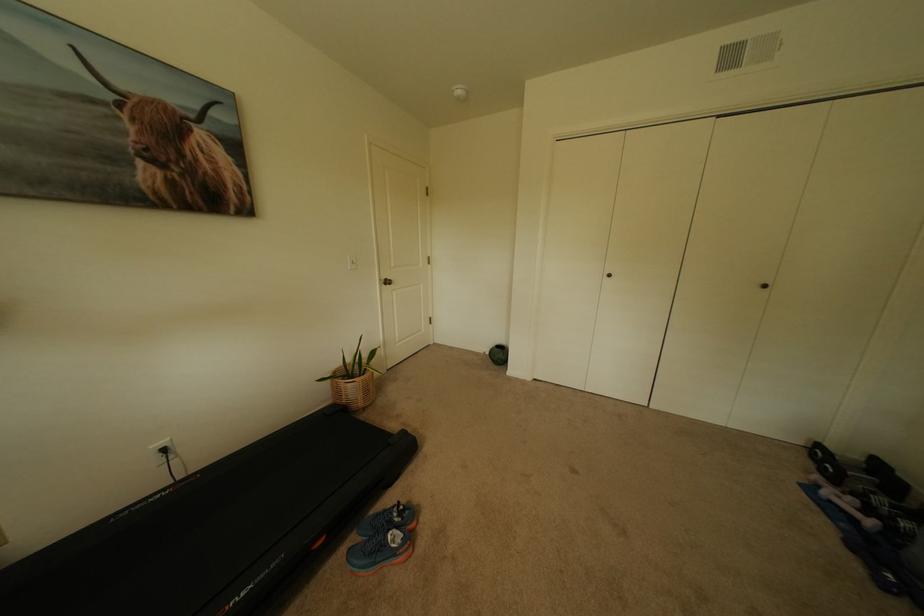
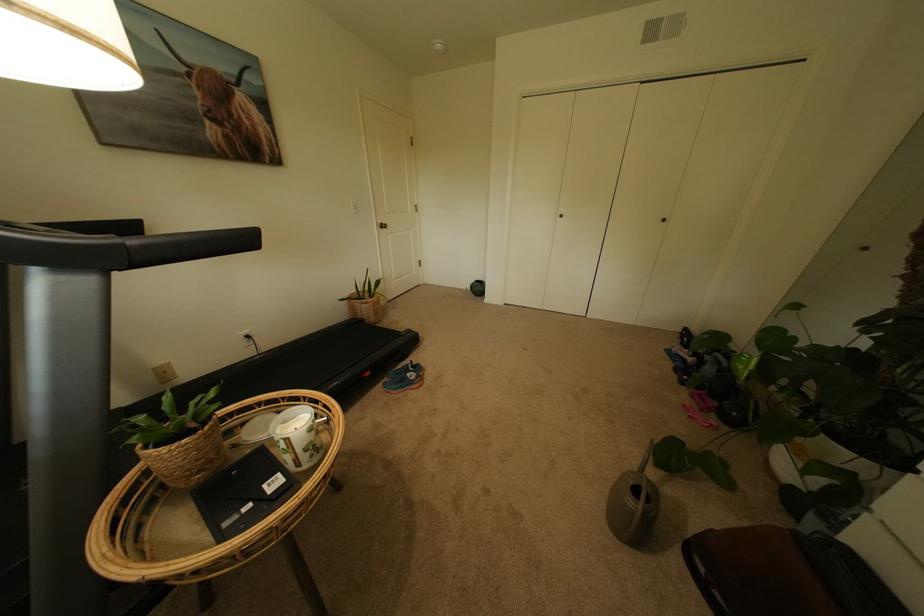
Where in the second image is the point corresponding to (398,285) from the first image?

(394, 229)